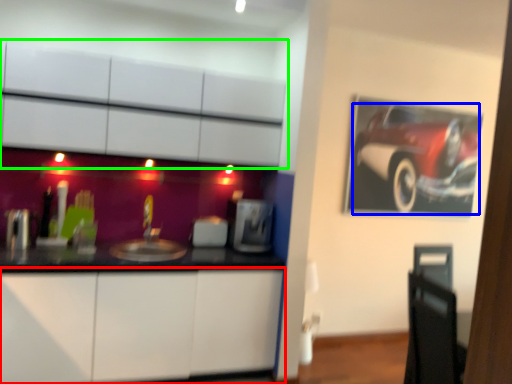
Question: Considering the real-world distances, which object is closest to cabinetry (highlighted by a red box)? land vehicle (highlighted by a blue box) or cabinetry (highlighted by a green box).

Choices:
 (A) land vehicle
 (B) cabinetry

Answer: (B)